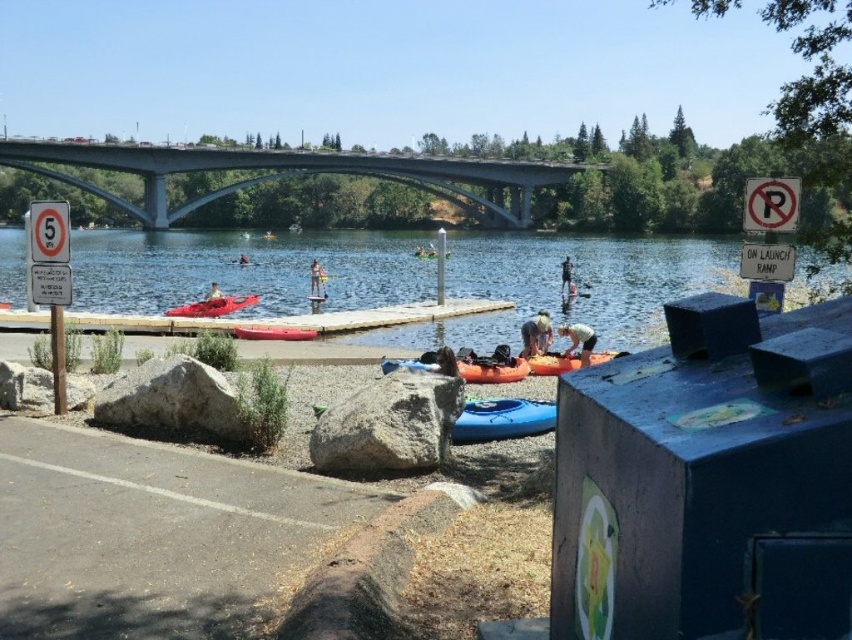
Which is behind, point (321, 280) or point (321, 278)?

Positioned behind is point (321, 280).

Is light brown wooden paddleboard at center closer to the viewer compared to red plastic paddle at center?

Yes, light brown wooden paddleboard at center is closer to the viewer.

Is point (323, 269) more distant than point (324, 276)?

Yes, it is behind point (324, 276).

Where is `light brown wooden paddleboard at center`? light brown wooden paddleboard at center is located at coordinates pos(315,280).

Does blue rubber kayak at center come behind smooth red kayak at center?

No, it is not.

Can you confirm if blue rubber kayak at center is positioned below smooth red kayak at center?

Indeed, blue rubber kayak at center is positioned under smooth red kayak at center.

Measure the distance between blue rubber kayak at center and camera.

blue rubber kayak at center and camera are 39.73 feet apart from each other.

Find the location of a particular element. blue rubber kayak at center is located at coordinates (502, 419).

Consider the image. Does matte red kayak at center appear on the right side of orange fabric person at center?

Incorrect, matte red kayak at center is not on the right side of orange fabric person at center.

Looking at this image, does matte red kayak at center have a lesser height compared to orange fabric person at center?

Incorrect, matte red kayak at center's height does not fall short of orange fabric person at center's.

Which is in front, point (246, 304) or point (447, 362)?

Point (447, 362) is in front.

At what (x,y) coordinates should I click in order to perform the action: click on matte red kayak at center. Please return your answer as a coordinate pair (x, y). This screenshot has height=640, width=852. Looking at the image, I should click on (213, 307).